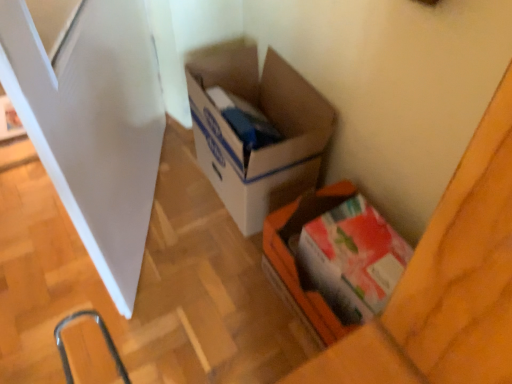
Question: Is cardboard box at center, which is counted as the second box, starting from the front, far from white glossy screen door at left?

Choices:
 (A) yes
 (B) no

Answer: (B)

Question: Considering the relative positions of cardboard box at center, which is counted as the second box, starting from the front, and white glossy screen door at left in the image provided, is cardboard box at center, which is counted as the second box, starting from the front, to the left of white glossy screen door at left from the viewer's perspective?

Choices:
 (A) no
 (B) yes

Answer: (A)

Question: Could you tell me if cardboard box at center, which is counted as the 1th box, starting from the back, is facing white glossy screen door at left?

Choices:
 (A) no
 (B) yes

Answer: (B)

Question: Is cardboard box at center, which is counted as the 1th box, starting from the back, completely or partially outside of white glossy screen door at left?

Choices:
 (A) no
 (B) yes

Answer: (B)

Question: Does cardboard box at center, which is counted as the 1th box, starting from the back, have a lesser width compared to white glossy screen door at left?

Choices:
 (A) no
 (B) yes

Answer: (A)

Question: Do you think white glossy screen door at left is within cardboard box at center, which is counted as the 1th box, starting from the back, or outside of it?

Choices:
 (A) outside
 (B) inside

Answer: (A)

Question: In the image, is white glossy screen door at left positioned in front of or behind cardboard box at center, which is counted as the second box, starting from the front?

Choices:
 (A) behind
 (B) front

Answer: (B)

Question: Looking at the image, does white glossy screen door at left seem bigger or smaller compared to cardboard box at center, which is counted as the 1th box, starting from the back?

Choices:
 (A) big
 (B) small

Answer: (A)

Question: Looking at their shapes, would you say white glossy screen door at left is wider or thinner than cardboard box at center, which is counted as the 1th box, starting from the back?

Choices:
 (A) thin
 (B) wide

Answer: (A)

Question: From the image's perspective, is cardboard box at center, which is counted as the second box, starting from the front, above or below white glossy screen door at left?

Choices:
 (A) below
 (B) above

Answer: (A)

Question: Is cardboard box at center, which is counted as the second box, starting from the front, taller or shorter than white glossy screen door at left?

Choices:
 (A) short
 (B) tall

Answer: (A)

Question: Does point (310, 135) appear closer or farther from the camera than point (143, 38)?

Choices:
 (A) closer
 (B) farther

Answer: (A)

Question: Which is correct: cardboard box at center, which is counted as the 1th box, starting from the back, is inside white glossy screen door at left, or outside of it?

Choices:
 (A) inside
 (B) outside

Answer: (B)

Question: Considering the positions of cardboard box at center, which is counted as the second box, starting from the front, and matte cardboard box at lower right, which appears as the first box when viewed from the front, in the image, is cardboard box at center, which is counted as the second box, starting from the front, taller or shorter than matte cardboard box at lower right, which appears as the first box when viewed from the front,?

Choices:
 (A) short
 (B) tall

Answer: (B)

Question: In terms of size, does cardboard box at center, which is counted as the second box, starting from the front, appear bigger or smaller than matte cardboard box at lower right, which appears as the first box when viewed from the front?

Choices:
 (A) big
 (B) small

Answer: (A)